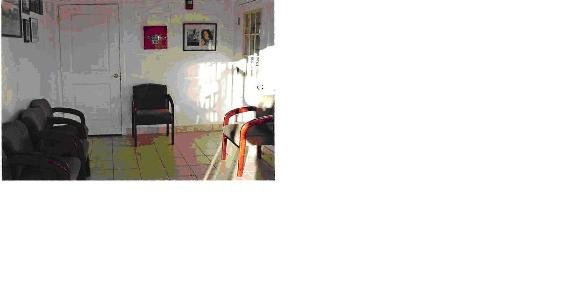
The image size is (576, 294). Find the location of `white door`. white door is located at coordinates (92, 56).